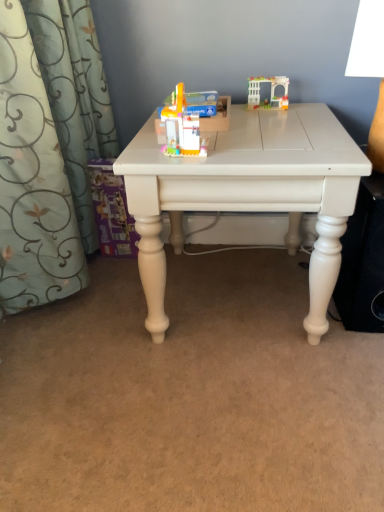
Where is `vacant area in front of translucent plastic toy at center, acting as the second toy starting from the top`? The width and height of the screenshot is (384, 512). vacant area in front of translucent plastic toy at center, acting as the second toy starting from the top is located at coordinates (189, 161).